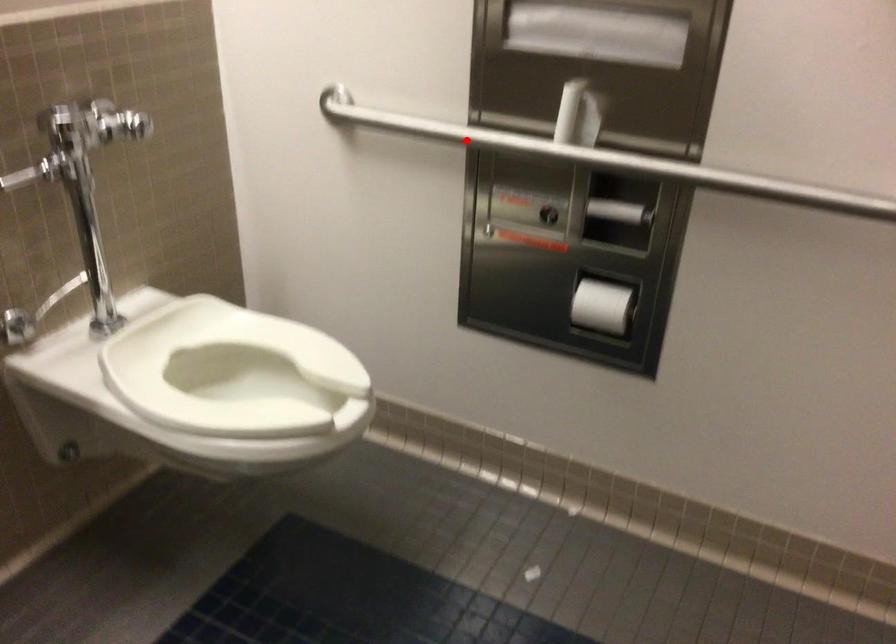
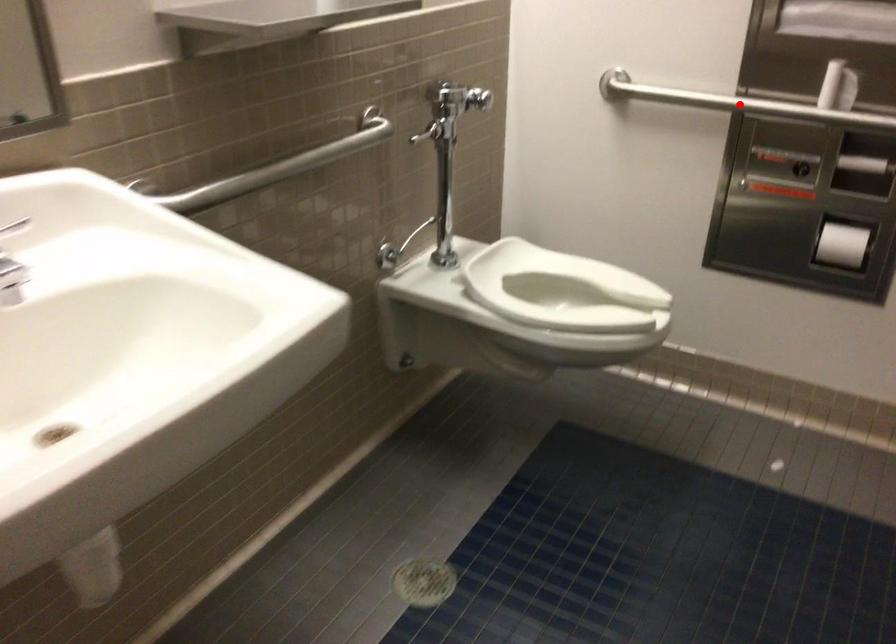
I am providing you with two images of the same scene from different viewpoints. A red point is marked on the first image and another point is marked on the second image. Is the red point in image1 aligned with the point shown in image2?

Yes